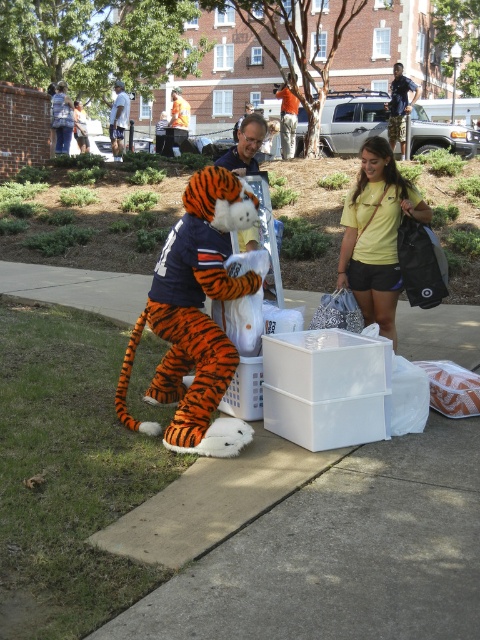
Question: Which object appears closest to the camera in this image?

Choices:
 (A) orange and black plush tiger at center
 (B) denim shorts at upper right

Answer: (A)

Question: Is yellow matte shirt at center above matte black sunglasses at center?

Choices:
 (A) yes
 (B) no

Answer: (B)

Question: Does orange and black plush tiger at center have a larger size compared to white t-shirt at center?

Choices:
 (A) yes
 (B) no

Answer: (A)

Question: Which is nearer to the orange and black plush tiger at center?

Choices:
 (A) matte black sunglasses at center
 (B) white t-shirt at center
 (C) denim shorts at upper right

Answer: (A)

Question: Which of the following is the farthest from the observer?

Choices:
 (A) denim jacket at upper left
 (B) white t-shirt at center
 (C) yellow matte shirt at center

Answer: (B)

Question: Does denim jacket at upper left have a greater width compared to orange cotton t-shirt at upper center?

Choices:
 (A) yes
 (B) no

Answer: (A)